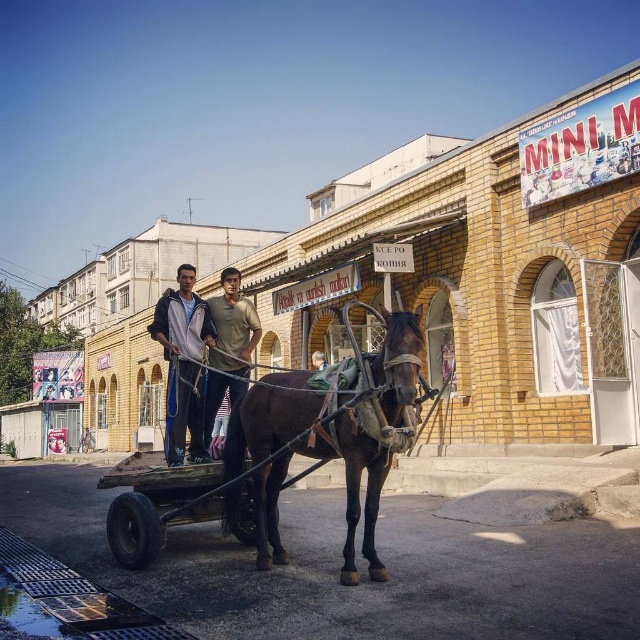
You are standing at the camera position and want to throw a ball to the point marked at coordinates [298,406]. If your throwing range is 15 meters, will you be able to reach it?

The point marked at coordinates [298,406] is 15.15 meters away from the camera. Since your throwing range is 15 meters, you will not be able to reach it.

You are a tourist in this urban area and want to take a photo of the shiny brown horse at center and the light brown cotton shirt at center. Which object should you focus on first if you want to capture both in a single frame without moving the camera?

The shiny brown horse at center is smaller than the light brown cotton shirt at center, so you should focus on the light brown cotton shirt at center first to ensure it fits within the frame.

You are standing in front of the MINI M building and see the shiny brown horse at center and the light brown leather jacket at center. Which object is positioned more to the left?

The light brown leather jacket at center is positioned more to the left than the shiny brown horse at center.